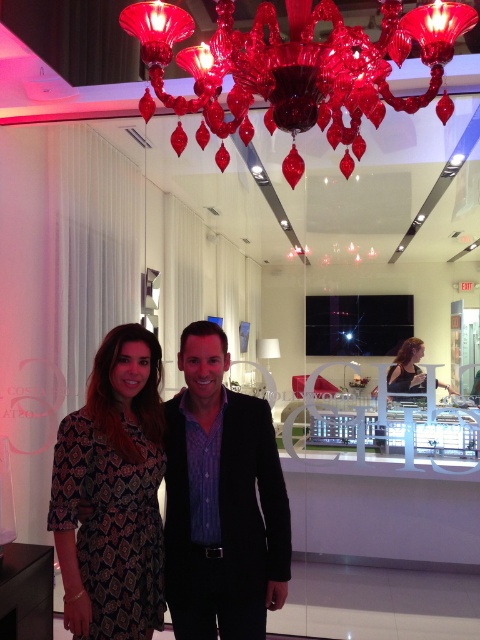
This screenshot has width=480, height=640. What do you see at coordinates (112, 493) in the screenshot?
I see `patterned fabric dress at left` at bounding box center [112, 493].

Consider the image. Can you confirm if patterned fabric dress at left is shorter than matte black dress at center?

No.

Which is behind, point (142, 328) or point (420, 358)?

The point (420, 358) is behind.

You are a GUI agent. You are given a task and a screenshot of the screen. Output one action in this format:
    pyautogui.click(x=<x>, y=<y>)
    Task: Click on the patterned fabric dress at left
    Image resolution: width=480 pixels, height=640 pixels.
    Given the screenshot: What is the action you would take?
    pyautogui.click(x=112, y=493)

Between ruby glass chandelier at upper center and patterned fabric dress at left, which one has more height?

Standing taller between the two is patterned fabric dress at left.

Between point (300, 81) and point (73, 502), which one is positioned behind?

Positioned behind is point (73, 502).

Locate an element on the screen. Image resolution: width=480 pixels, height=640 pixels. ruby glass chandelier at upper center is located at coordinates (296, 67).

Who is taller, matte black suit at center or matte black dress at center?

With more height is matte black suit at center.

Who is shorter, matte black suit at center or matte black dress at center?

With less height is matte black dress at center.

Does point (226, 410) lie behind point (407, 376)?

That is False.

I want to click on matte black suit at center, so click(x=222, y=500).